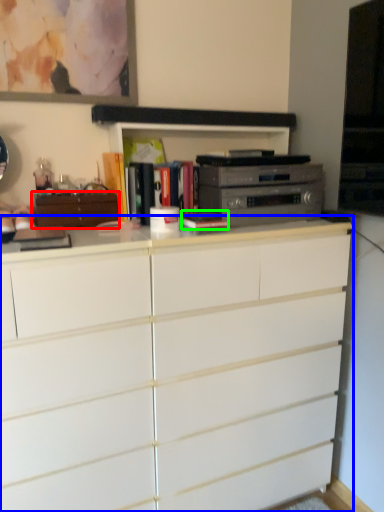
Question: Which object is positioned farthest from cabinetry (highlighted by a red box)? Select from chest of drawers (highlighted by a blue box) and book (highlighted by a green box).

Choices:
 (A) chest of drawers
 (B) book

Answer: (A)